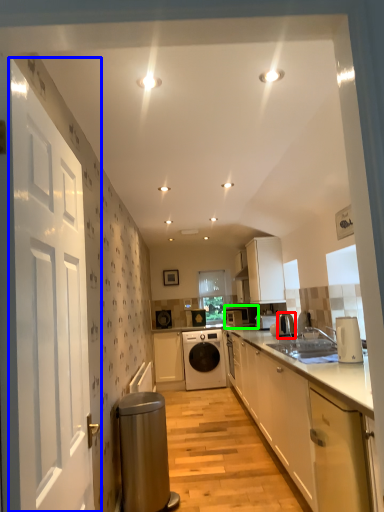
Question: Which object is positioned closest to appliance (highlighted by a red box)? Select from door (highlighted by a blue box) and appliance (highlighted by a green box).

Choices:
 (A) door
 (B) appliance

Answer: (B)